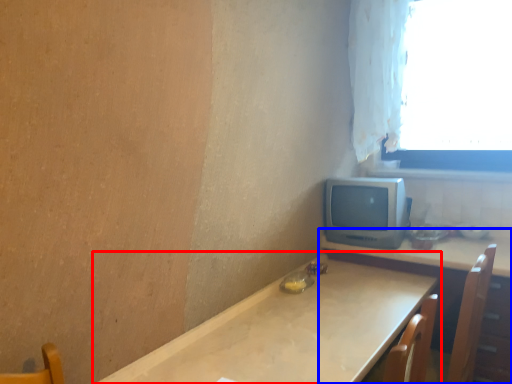
Question: Which of the following is the farthest to the observer, table (highlighted by a red box) or table (highlighted by a blue box)?

Choices:
 (A) table
 (B) table

Answer: (B)